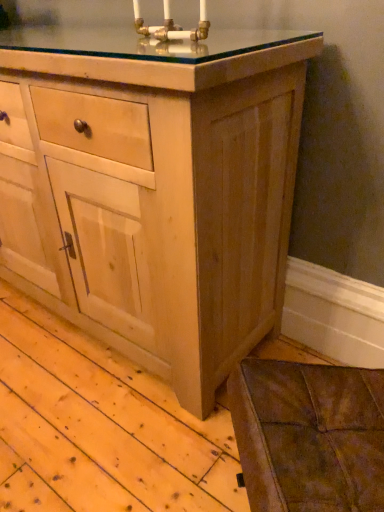
Identify the location of vacant region under gold brass candle holder at upper center (from a real-world perspective). The height and width of the screenshot is (512, 384). (167, 42).